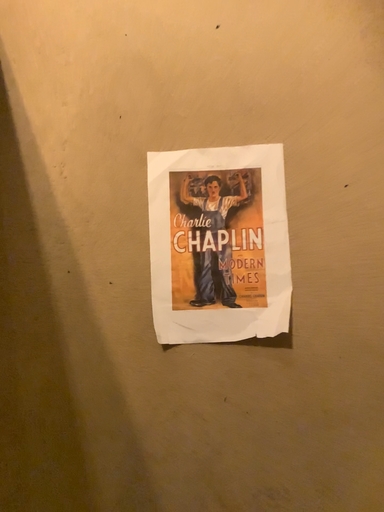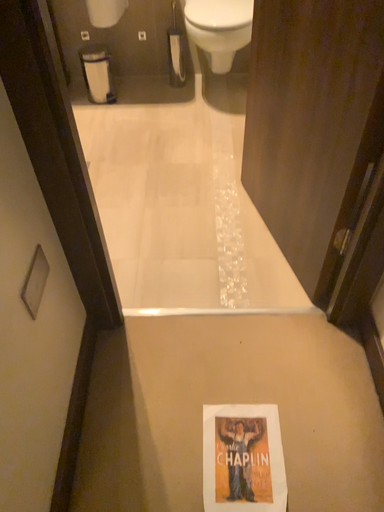
Question: How did the camera likely rotate when shooting the video?

Choices:
 (A) rotated downward
 (B) rotated upward

Answer: (B)